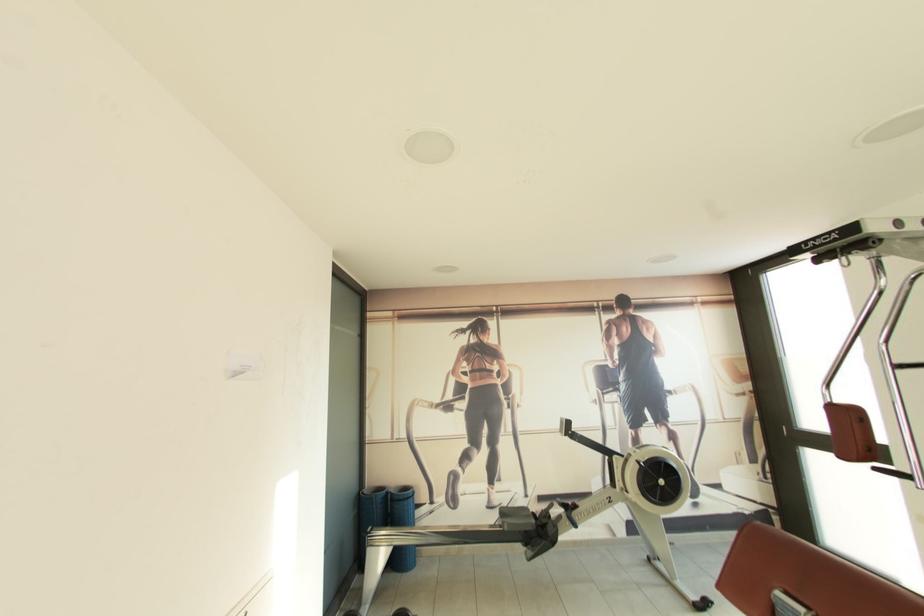
Where would you sit the rowing machine seat? Please return your answer as a coordinate pair (x, y).

(804, 578)